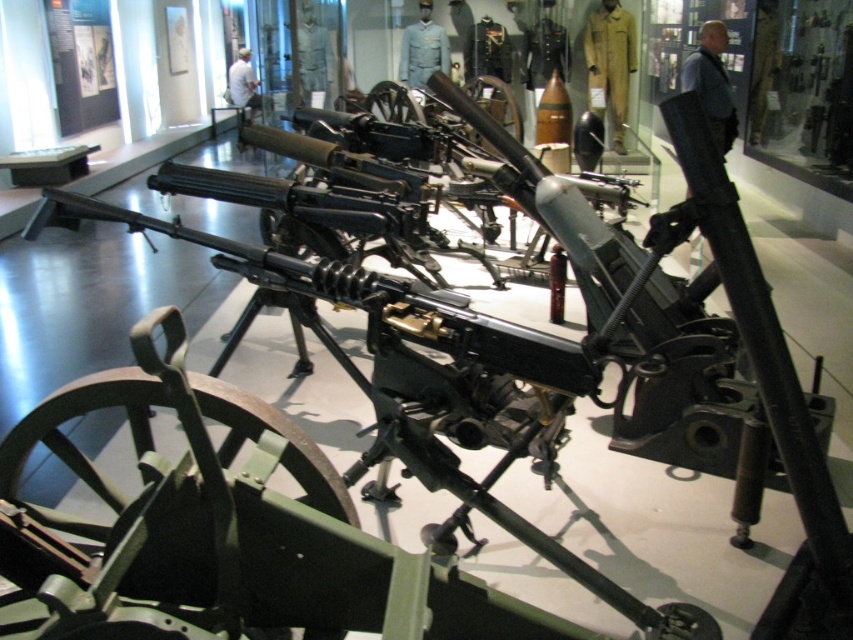
Question: Which object is positioned farthest from the khaki fabric uniform at center?

Choices:
 (A) white shirt at center
 (B) light blue fabric uniform at center

Answer: (A)

Question: Is khaki fabric uniform at center wider than white shirt at center?

Choices:
 (A) no
 (B) yes

Answer: (A)

Question: Is khaki fabric uniform at center positioned at the back of white shirt at center?

Choices:
 (A) no
 (B) yes

Answer: (A)

Question: Among these objects, which one is nearest to the camera?

Choices:
 (A) khaki fabric uniform at center
 (B) light blue fabric uniform at center

Answer: (B)

Question: Does khaki fabric uniform at center appear on the left side of light blue fabric uniform at center?

Choices:
 (A) no
 (B) yes

Answer: (A)

Question: Which point is farther to the camera?

Choices:
 (A) light blue fabric uniform at center
 (B) khaki fabric uniform at center

Answer: (B)